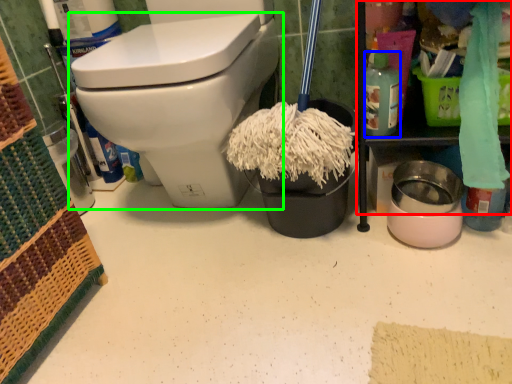
Question: Estimate the real-world distances between objects in this image. Which object is closer to cabinetry (highlighted by a red box), cleaning product (highlighted by a blue box) or toilet (highlighted by a green box)?

Choices:
 (A) cleaning product
 (B) toilet

Answer: (A)